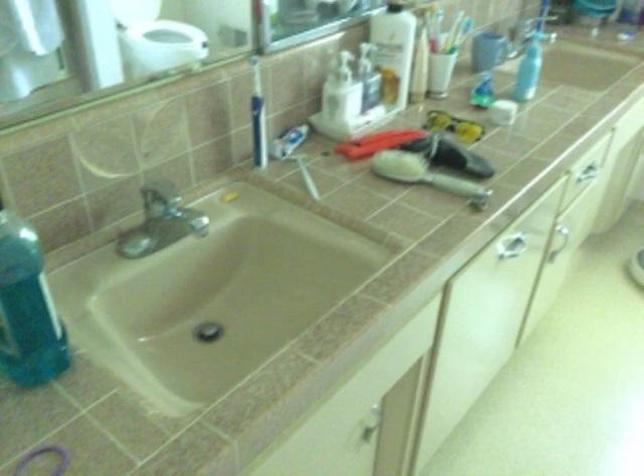
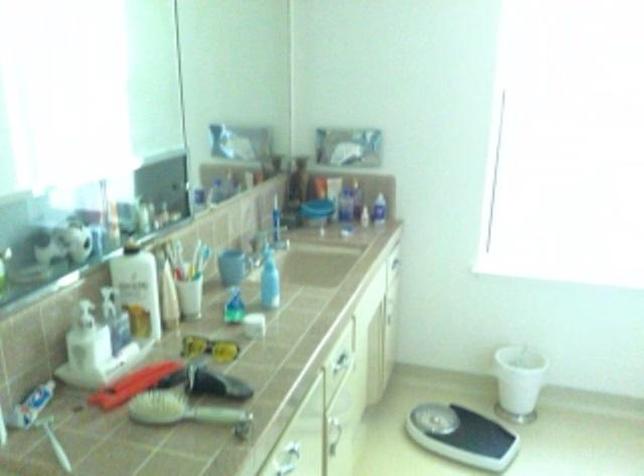
Find the pixel in the second image that matches [418,175] in the first image.

(178, 410)